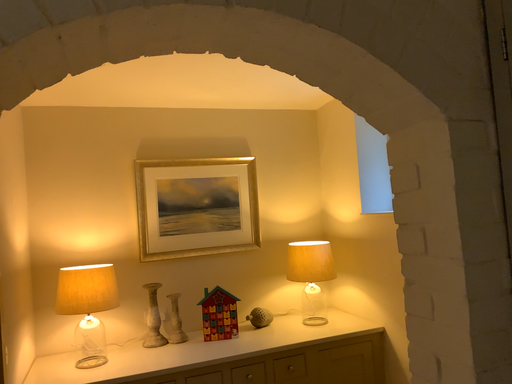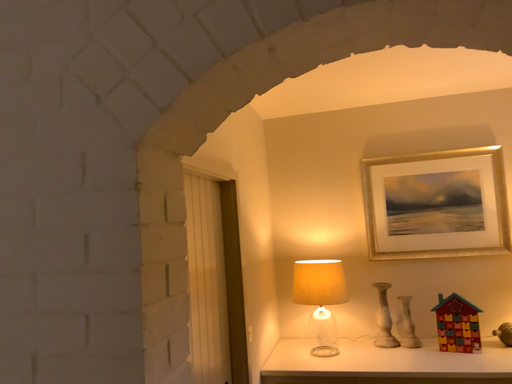
Question: Which way did the camera rotate in the video?

Choices:
 (A) rotated left
 (B) rotated right

Answer: (A)